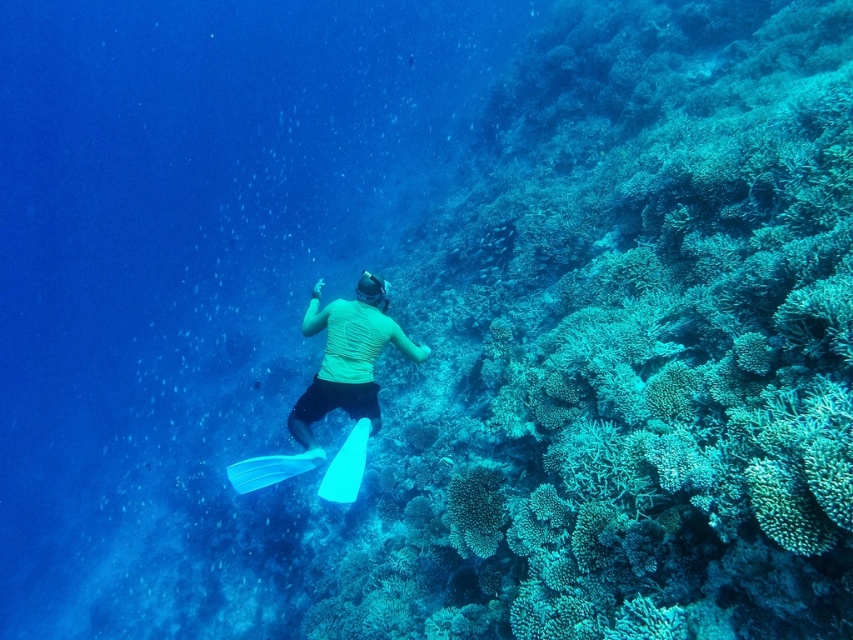
Question: Can you confirm if green textured coral at center is positioned to the left of transparent plastic paddle at lower center?

Choices:
 (A) no
 (B) yes

Answer: (A)

Question: Estimate the real-world distances between objects in this image. Which object is farther from the green textured coral reef at center?

Choices:
 (A) yellow matte shirt at center
 (B) translucent plastic paddle at lower center

Answer: (A)

Question: Is green textured coral reef at center closer to camera compared to transparent plastic paddle at lower center?

Choices:
 (A) no
 (B) yes

Answer: (A)

Question: Which point appears farthest from the camera in this image?

Choices:
 (A) pos(236,468)
 (B) pos(633,554)

Answer: (A)

Question: Does green textured coral reef at center have a greater width compared to translucent plastic paddle at lower center?

Choices:
 (A) no
 (B) yes

Answer: (A)

Question: Which object is positioned closest to the green textured coral reef at center?

Choices:
 (A) yellow matte shirt at center
 (B) transparent plastic paddle at lower center
 (C) translucent plastic paddle at lower center

Answer: (B)